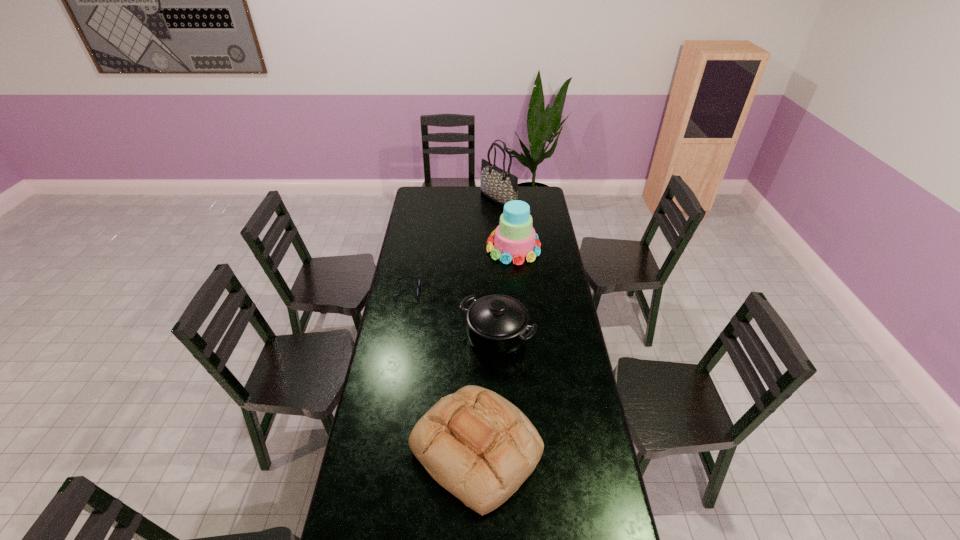
Find the location of a particular element. This screenshot has width=960, height=540. tote bag is located at coordinates (500, 186).

I want to click on the farthest object, so click(x=500, y=186).

Image resolution: width=960 pixels, height=540 pixels. Find the location of `the second tallest object`. the second tallest object is located at coordinates (514, 239).

The image size is (960, 540). I want to click on the fourth nearest object, so click(514, 239).

Identify the location of the second nearest object. The height and width of the screenshot is (540, 960). (497, 325).

Where is `bread`? This screenshot has width=960, height=540. bread is located at coordinates (480, 447).

Image resolution: width=960 pixels, height=540 pixels. Find the location of `spectacles`. spectacles is located at coordinates (418, 285).

Locate an element on the screen. This screenshot has height=540, width=960. the leftmost object is located at coordinates (418, 285).

Locate an element on the screen. The height and width of the screenshot is (540, 960). blank space located on the front of the tote bag is located at coordinates (501, 249).

Find the location of a particular element. free space located 0.150m on the front of the fourth shortest object is located at coordinates (517, 285).